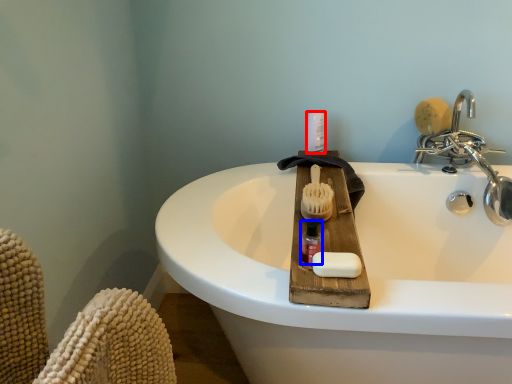
Question: Which of the following is the farthest to the observer, toiletry (highlighted by a red box) or mouthwash (highlighted by a blue box)?

Choices:
 (A) toiletry
 (B) mouthwash

Answer: (A)